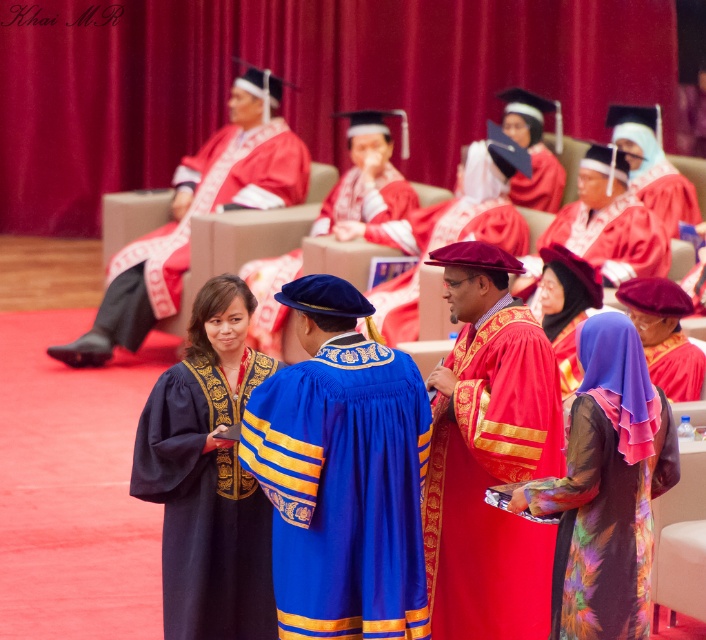
You are a photographer at the graduation ceremony. You want to capture a photo where both the velvet maroon graduation gown at center and the purple satin hijab at center are clearly visible. Based on their positions, which one should you focus on first to ensure both are in focus?

The velvet maroon graduation gown at center is positioned under the purple satin hijab at center. To ensure both are in focus, you should focus on the velvet maroon graduation gown at center first since it is closer to the camera, and the hijab will naturally fall within the depth of field.